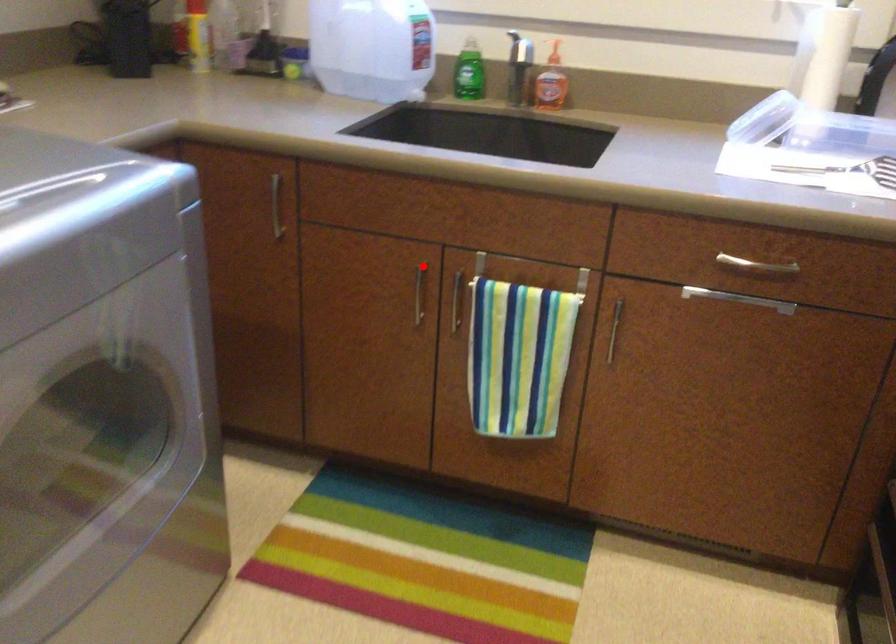
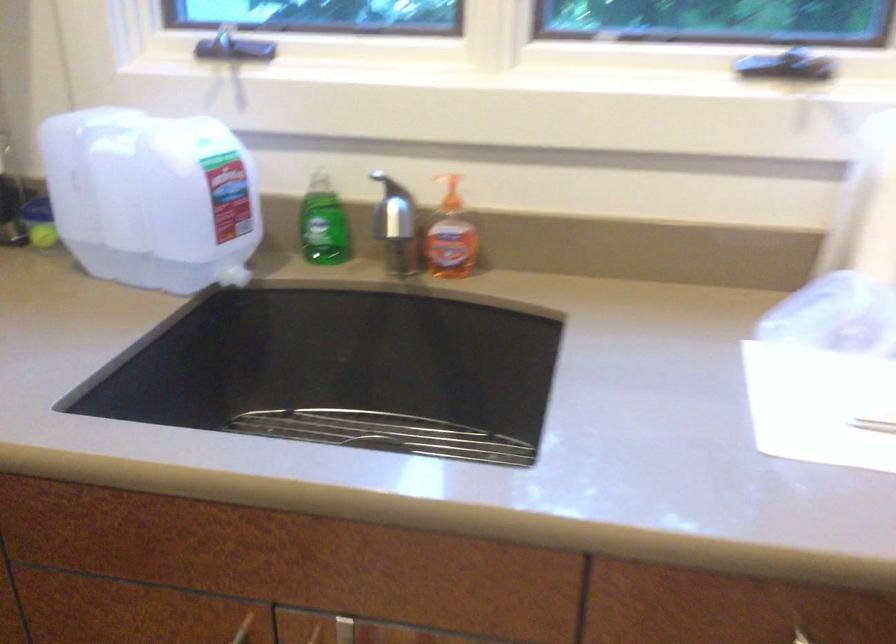
Find the pixel in the second image that matches the highlighted location in the first image.

(243, 629)